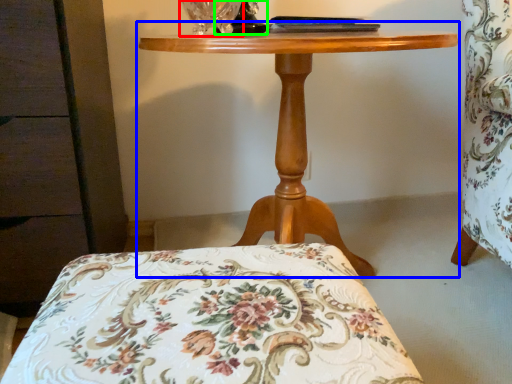
Question: Which object is the closest to the glass vase (highlighted by a red box)? Choose among these: table (highlighted by a blue box) or table lamp (highlighted by a green box).

Choices:
 (A) table
 (B) table lamp

Answer: (B)